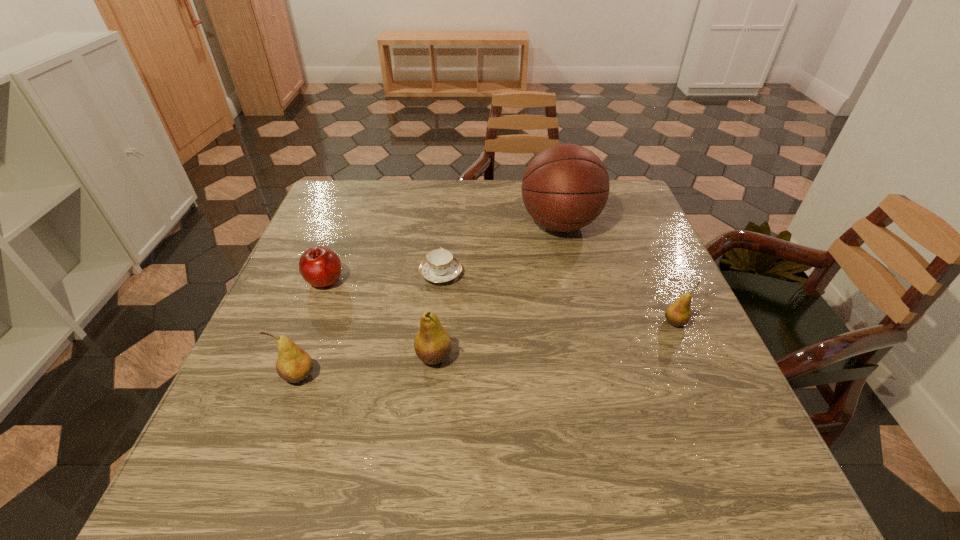
The image size is (960, 540). I want to click on free space between the second pear from left to right and the basketball, so click(497, 290).

Where is `vacant space that's between the second object from right to left and the teacup`? vacant space that's between the second object from right to left and the teacup is located at coordinates (500, 249).

The height and width of the screenshot is (540, 960). I want to click on unoccupied area between the teacup and the second tallest object, so click(438, 315).

At what (x,y) coordinates should I click in order to perform the action: click on free space between the leftmost pear and the apple. Please return your answer as a coordinate pair (x, y). The width and height of the screenshot is (960, 540). Looking at the image, I should click on (312, 328).

Where is `free space between the fourth shortest object and the basketball`? The width and height of the screenshot is (960, 540). free space between the fourth shortest object and the basketball is located at coordinates (430, 300).

What are the coordinates of `vacant space that's between the shortest object and the second tallest object` in the screenshot? It's located at (438, 315).

At what (x,y) coordinates should I click in order to perform the action: click on blank region between the tallest pear and the teacup. Please return your answer as a coordinate pair (x, y). Looking at the image, I should click on (438, 315).

Find the location of a particular element. free spot between the shortest object and the tallest pear is located at coordinates (438, 315).

Identify the location of vacant area that lies between the fourth shortest object and the teacup. (371, 325).

This screenshot has width=960, height=540. Identify the location of blank region between the farthest object and the rightmost pear. 617,273.